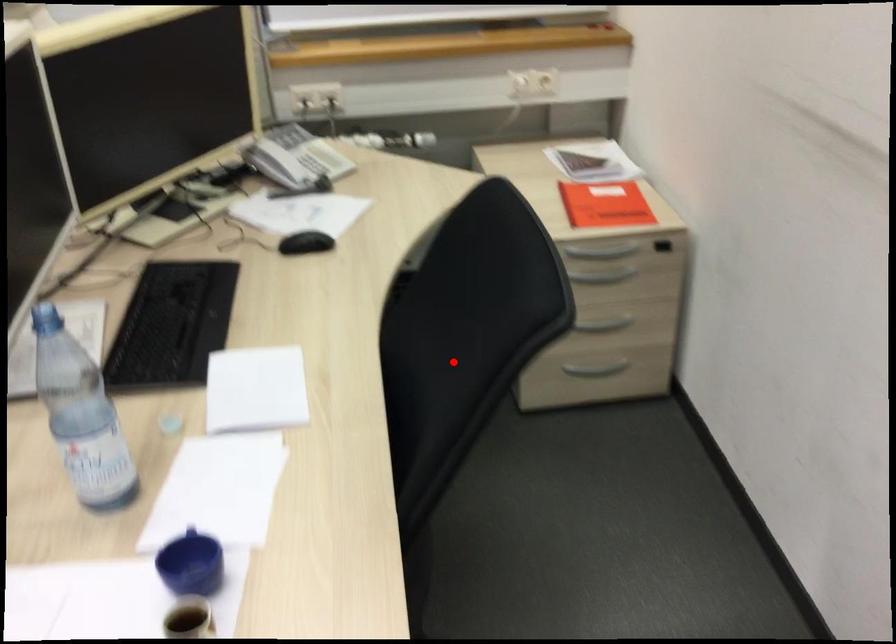
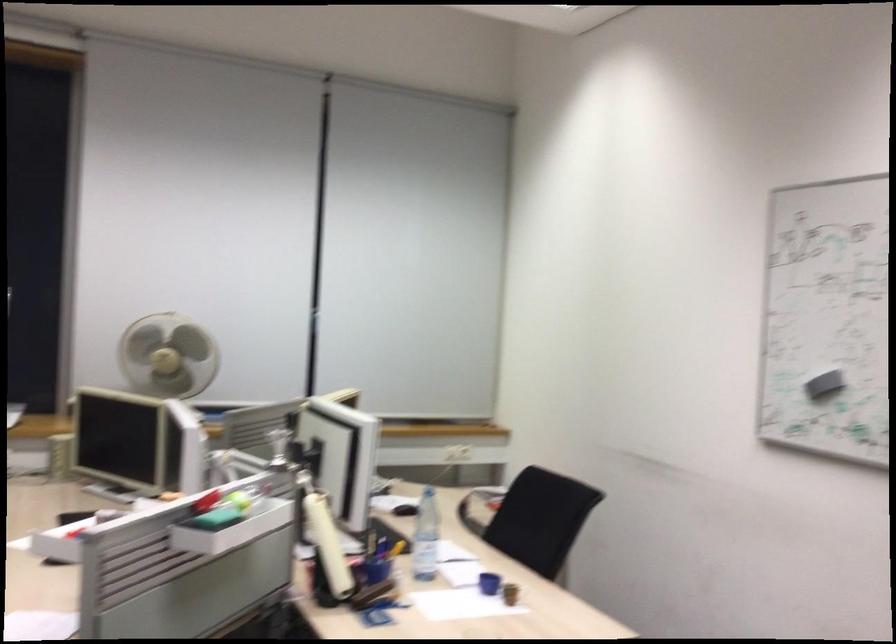
Question: I am providing you with two images of the same scene from different viewpoints. In image1, a red point is highlighted. Considering the same 3D point in image2, which of the following is correct?

Choices:
 (A) It is closer
 (B) It is farther

Answer: (B)